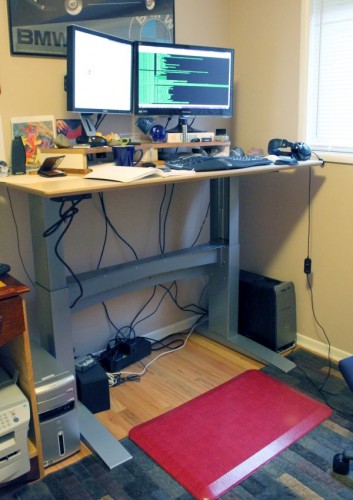
I want to click on red rubber floor mat, so click(209, 435).